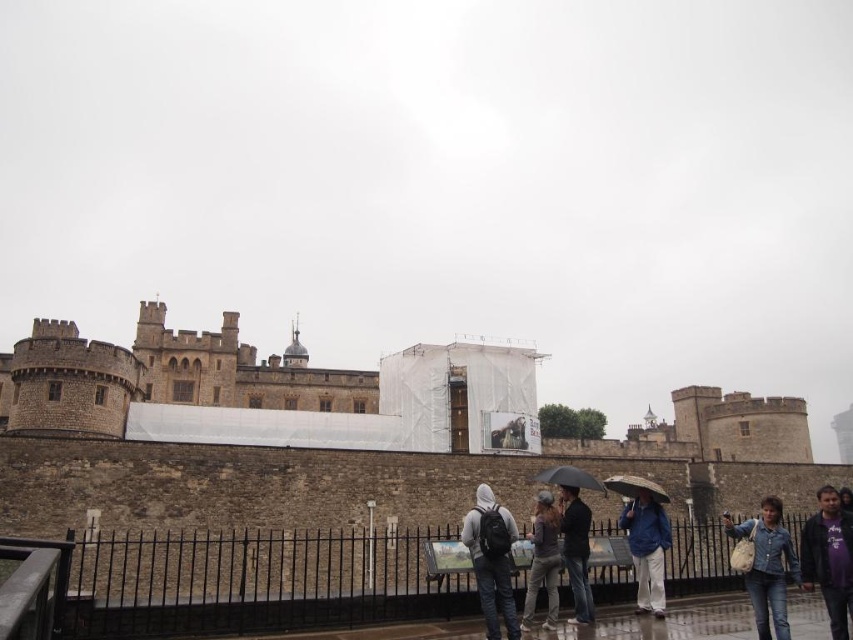
You are standing at the entrance of the castle and want to take a photo of the dark gray jacket at center without any obstructions. Is the blue fabric umbrella at lower right blocking your view?

The dark gray jacket at center is behind the blue fabric umbrella at lower right, so the umbrella is blocking the view of the jacket.